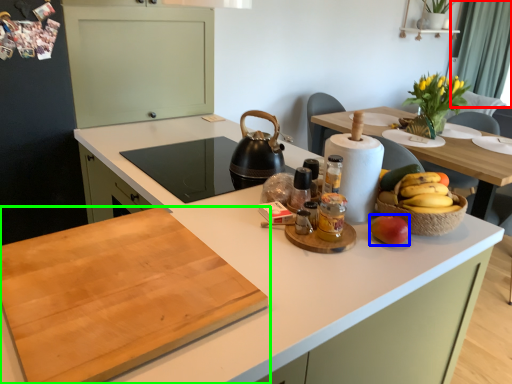
Question: Which is farther away from curtain (highlighted by a red box)? apple (highlighted by a blue box) or countertop (highlighted by a green box)?

Choices:
 (A) apple
 (B) countertop

Answer: (B)